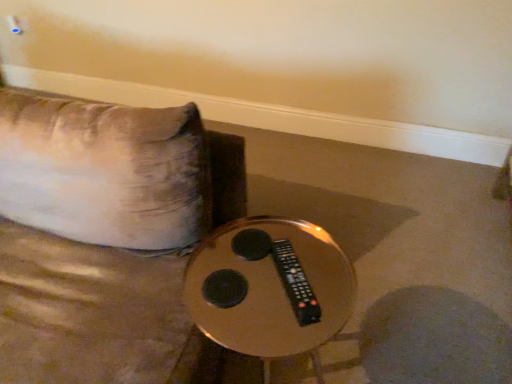
Question: Considering their positions, is metallic gold table at center located in front of or behind black plastic remote at center?

Choices:
 (A) front
 (B) behind

Answer: (A)

Question: Looking at their shapes, would you say metallic gold table at center is wider or thinner than black plastic remote at center?

Choices:
 (A) thin
 (B) wide

Answer: (B)

Question: Based on their sizes in the image, would you say metallic gold table at center is bigger or smaller than black plastic remote at center?

Choices:
 (A) small
 (B) big

Answer: (B)

Question: From the image's perspective, is black plastic remote at center positioned above or below metallic gold table at center?

Choices:
 (A) below
 (B) above

Answer: (B)

Question: In the image, is black plastic remote at center positioned in front of or behind metallic gold table at center?

Choices:
 (A) front
 (B) behind

Answer: (B)

Question: Is point (283, 251) positioned closer to the camera than point (281, 223)?

Choices:
 (A) closer
 (B) farther

Answer: (A)

Question: Would you say black plastic remote at center is inside or outside metallic gold table at center?

Choices:
 (A) outside
 (B) inside

Answer: (B)